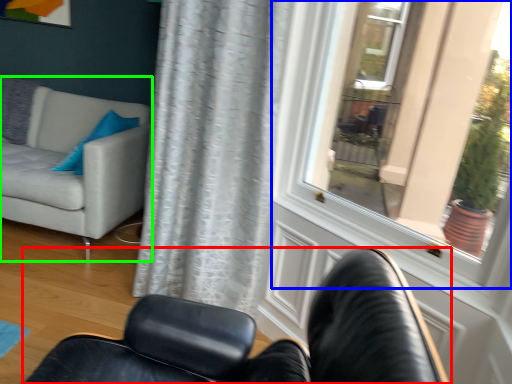
Question: Which object is the closest to the chair (highlighted by a red box)? Choose among these: window (highlighted by a blue box) or studio couch (highlighted by a green box).

Choices:
 (A) window
 (B) studio couch

Answer: (B)